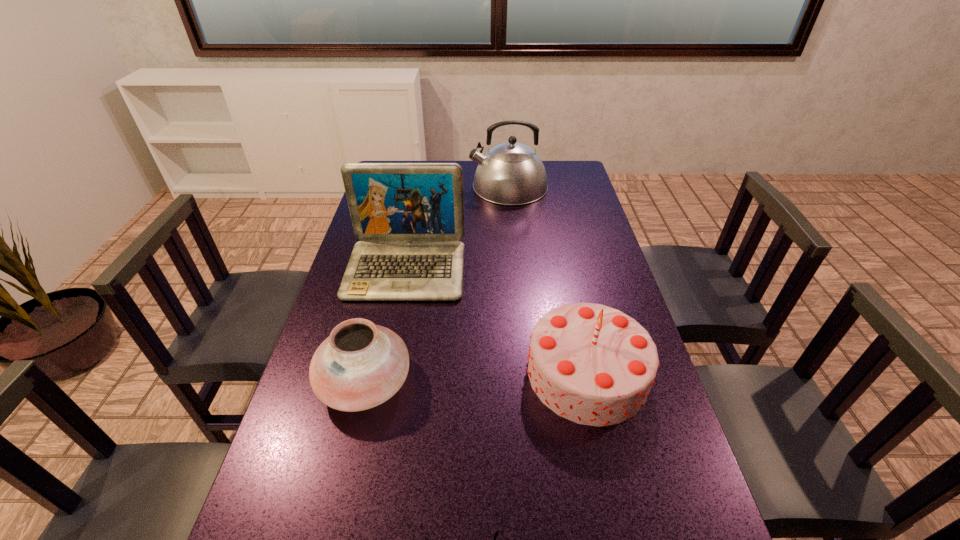
Locate an element on the screen. This screenshot has width=960, height=540. free spot between the second shortest object and the fourth nearest object is located at coordinates (385, 326).

Locate which object is the third closest to the nearest object. Please provide its 2D coordinates. Your answer should be formatted as a tuple, i.e. [(x, y)], where the tuple contains the x and y coordinates of a point satisfying the conditions above.

[(409, 216)]

Select which object is the closest to the kettle. Please provide its 2D coordinates. Your answer should be formatted as a tuple, i.e. [(x, y)], where the tuple contains the x and y coordinates of a point satisfying the conditions above.

[(409, 216)]

Identify the location of vacant space that satisfies the following two spatial constraints: 1. on the back side of the third shortest object; 2. from the spout of the kettle. This screenshot has height=540, width=960. (545, 186).

Where is `vacant space that satisfies the following two spatial constraints: 1. from the spout of the farthest object; 2. on the screen of the laptop computer`? This screenshot has width=960, height=540. vacant space that satisfies the following two spatial constraints: 1. from the spout of the farthest object; 2. on the screen of the laptop computer is located at coordinates (516, 269).

Where is `vacant space that satisfies the following two spatial constraints: 1. on the back side of the third shortest object; 2. from the spout of the farthest object`? vacant space that satisfies the following two spatial constraints: 1. on the back side of the third shortest object; 2. from the spout of the farthest object is located at coordinates (545, 186).

Locate an element on the screen. The height and width of the screenshot is (540, 960). vacant space that satisfies the following two spatial constraints: 1. from the spout of the farthest object; 2. on the right side of the birthday cake is located at coordinates (527, 373).

This screenshot has height=540, width=960. I want to click on free region that satisfies the following two spatial constraints: 1. on the screen of the third shortest object; 2. on the left side of the fourth nearest object, so click(x=386, y=373).

In order to click on vacant space that satisfies the following two spatial constraints: 1. on the screen of the birthday cake; 2. on the right side of the fourth nearest object in this screenshot , I will do `click(386, 373)`.